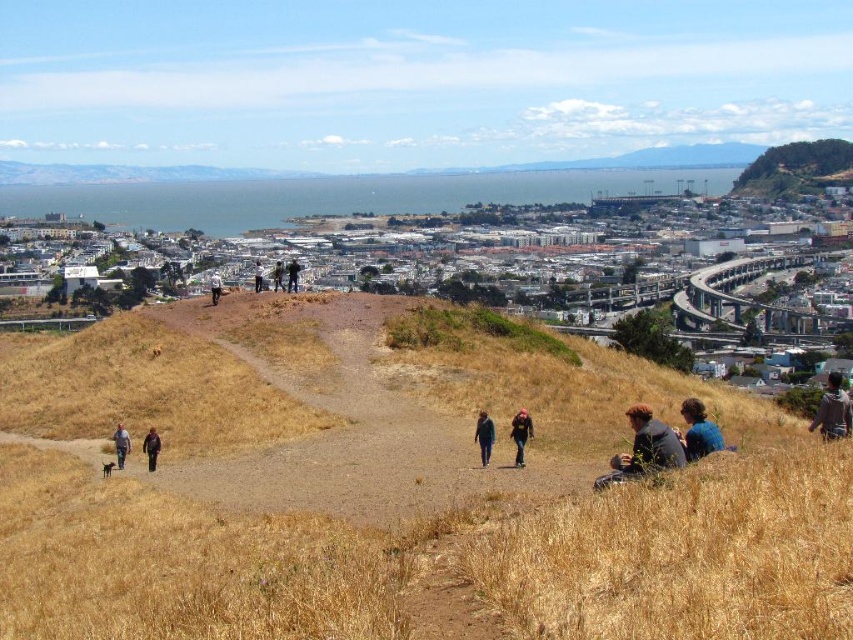
In the scene shown: You are a drone operator tasked with capturing aerial footage of the urban landscape. Your drone has a maximum flight range of 200 meters. You spot the black fabric jacket at center in the scene. Can your drone safely return to you from that location without exceeding its range?

The distance between the black fabric jacket at center and the camera is 250.36 meters. Since the drone has a maximum flight range of 200 meters, it cannot safely return without exceeding its range.

You are a delivery drone with a maximum flight range of 250 feet. You need to deliver a package from the black fabric jacket at center to the dark brown leather jacket at lower left. Can you complete the delivery without needing a recharge?

The distance between the black fabric jacket at center and the dark brown leather jacket at lower left is 263.65 feet, which exceeds the drone s 250 feet range. Therefore, the drone cannot complete the delivery without recharging.

You are a photographer looking to capture both the brown textured jacket at lower right and the black fabric jacket at center in a single frame. Which jacket should you focus on to ensure both are visible without zooming in?

The brown textured jacket at lower right is bigger than the black fabric jacket at center, so focusing on the brown textured jacket at lower right will help keep both jackets visible in the frame without needing to zoom in.